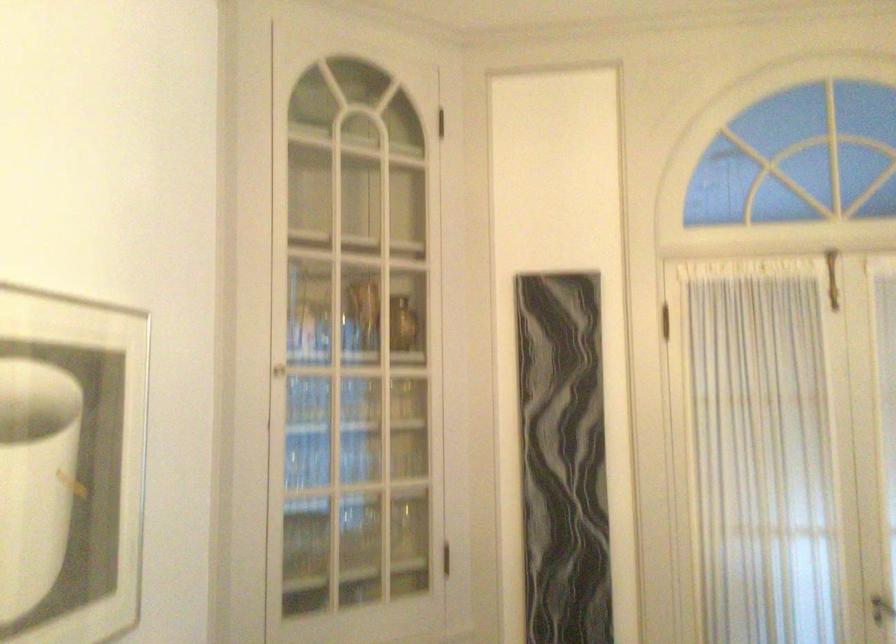
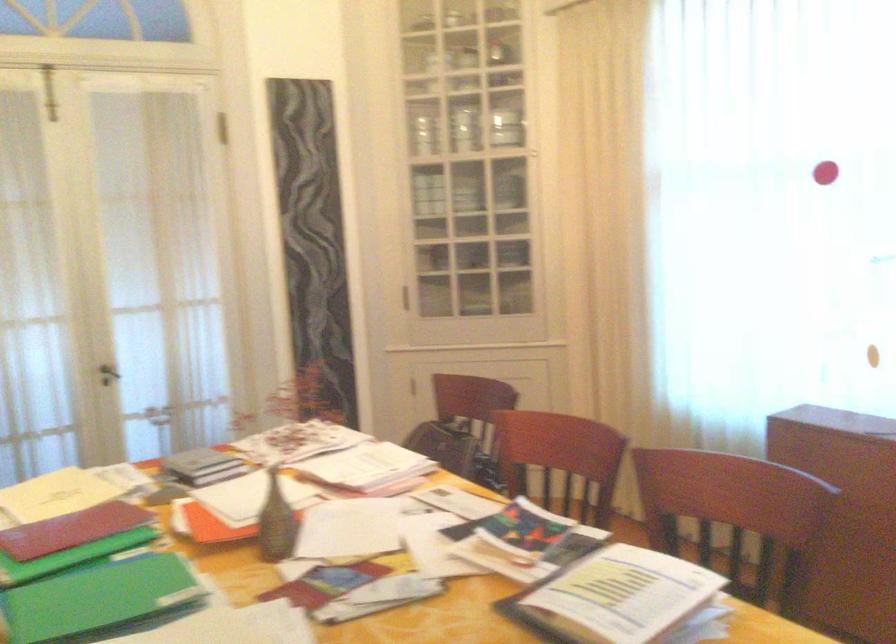
Question: Based on the continuous images, in which direction is the camera rotating? Reply with the corresponding letter.

Choices:
 (A) Left
 (B) Right
 (C) Up
 (D) Down

Answer: (B)